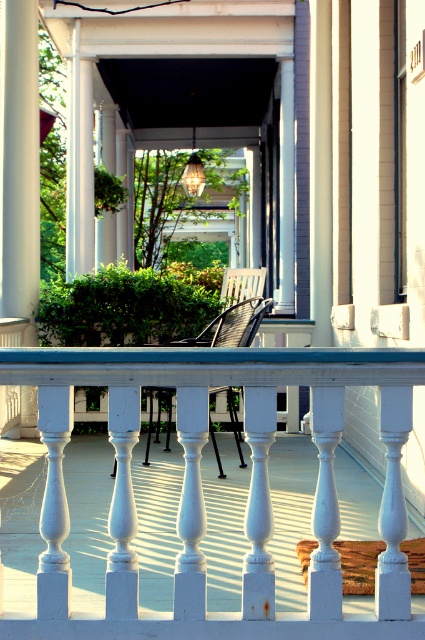
Question: Which point is farther to the camera?

Choices:
 (A) (42, 604)
 (B) (231, 301)

Answer: (B)

Question: Which point is farther from the camera taking this photo?

Choices:
 (A) [x=337, y=586]
 (B) [x=226, y=314]

Answer: (B)

Question: Does white painted wood balustrade at center appear on the right side of black woven chair at center?

Choices:
 (A) yes
 (B) no

Answer: (A)

Question: Considering the relative positions of white painted wood balustrade at center and black woven chair at center in the image provided, where is white painted wood balustrade at center located with respect to black woven chair at center?

Choices:
 (A) below
 (B) above

Answer: (A)

Question: Can you confirm if white painted wood balustrade at center is positioned to the left of black woven chair at center?

Choices:
 (A) yes
 (B) no

Answer: (B)